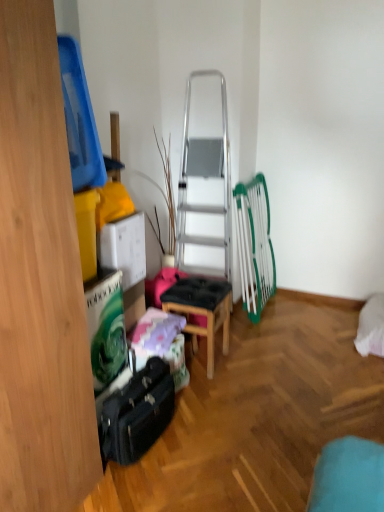
Question: From a real-world perspective, relative to black leather suitcase at lower left, is wooden stool at center vertically above or below?

Choices:
 (A) below
 (B) above

Answer: (B)

Question: From the image's perspective, is wooden stool at center located above or below black leather suitcase at lower left?

Choices:
 (A) above
 (B) below

Answer: (A)

Question: In the image, is wooden stool at center positioned in front of or behind black leather suitcase at lower left?

Choices:
 (A) front
 (B) behind

Answer: (B)

Question: In the image, is black leather suitcase at lower left on the left side or the right side of wooden stool at center?

Choices:
 (A) right
 (B) left

Answer: (B)

Question: From the image's perspective, is black leather suitcase at lower left positioned above or below wooden stool at center?

Choices:
 (A) above
 (B) below

Answer: (B)

Question: Considering the positions of black leather suitcase at lower left and wooden stool at center in the image, is black leather suitcase at lower left bigger or smaller than wooden stool at center?

Choices:
 (A) small
 (B) big

Answer: (A)

Question: Considering the positions of black leather suitcase at lower left and wooden stool at center in the image, is black leather suitcase at lower left wider or thinner than wooden stool at center?

Choices:
 (A) thin
 (B) wide

Answer: (A)